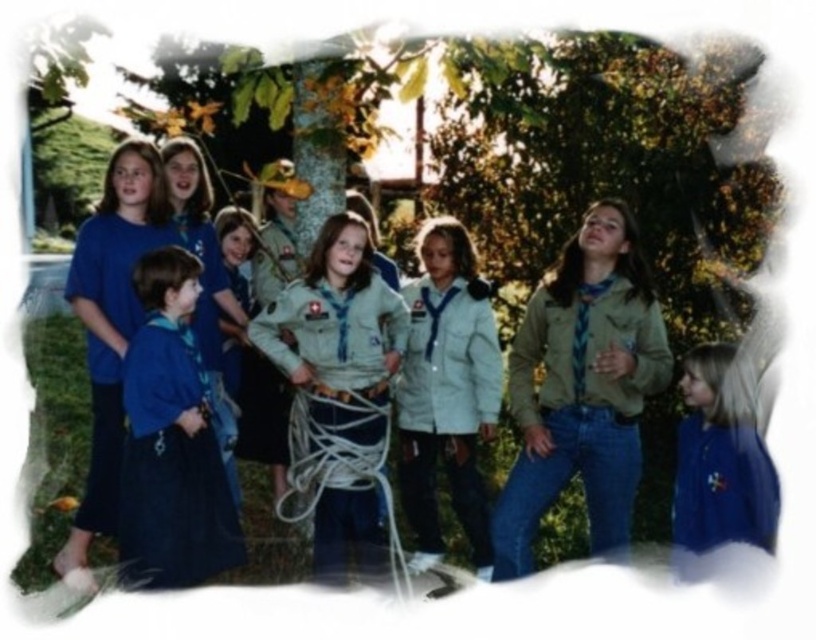
Question: Which object is farther from the camera taking this photo?

Choices:
 (A) blue matte shirt at lower right
 (B) light beige fabric uniform at center
 (C) blue fabric shirt at left

Answer: (C)

Question: Does blue matte shirt at lower right appear on the right side of blue fabric shirt at left?

Choices:
 (A) yes
 (B) no

Answer: (A)

Question: Which is farther from the blue fabric uniform at left?

Choices:
 (A) light beige fabric uniform at center
 (B) blue denim uniform at lower left
 (C) blue fabric shirt at left

Answer: (A)

Question: Among these objects, which one is farthest from the camera?

Choices:
 (A) blue fabric shirt at left
 (B) light beige fabric uniform at center
 (C) blue fabric uniform at left
 (D) light gray uniform at center

Answer: (D)

Question: Does light beige fabric uniform at center have a smaller size compared to light gray uniform at center?

Choices:
 (A) yes
 (B) no

Answer: (A)

Question: Does light beige fabric uniform at center have a greater width compared to blue fabric shirt at left?

Choices:
 (A) yes
 (B) no

Answer: (A)